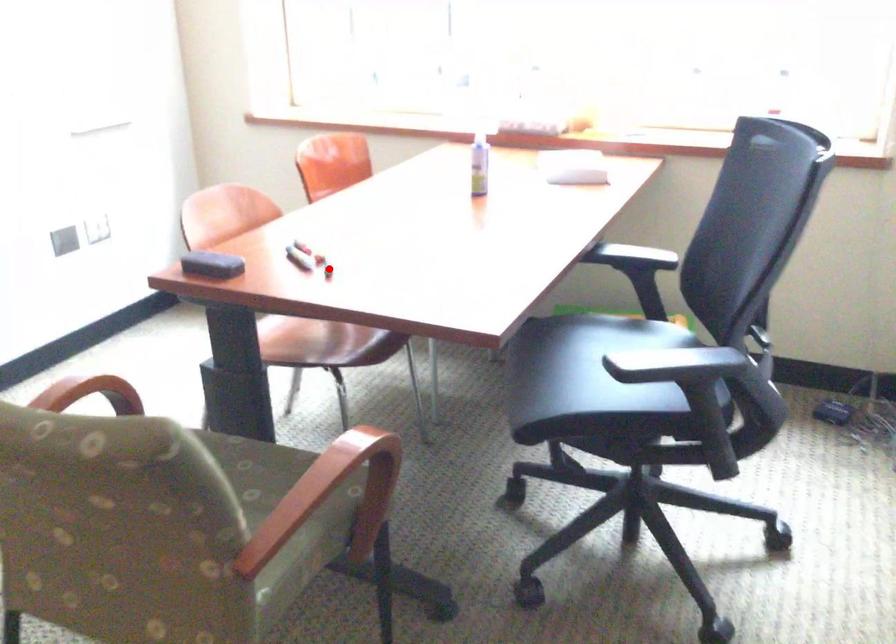
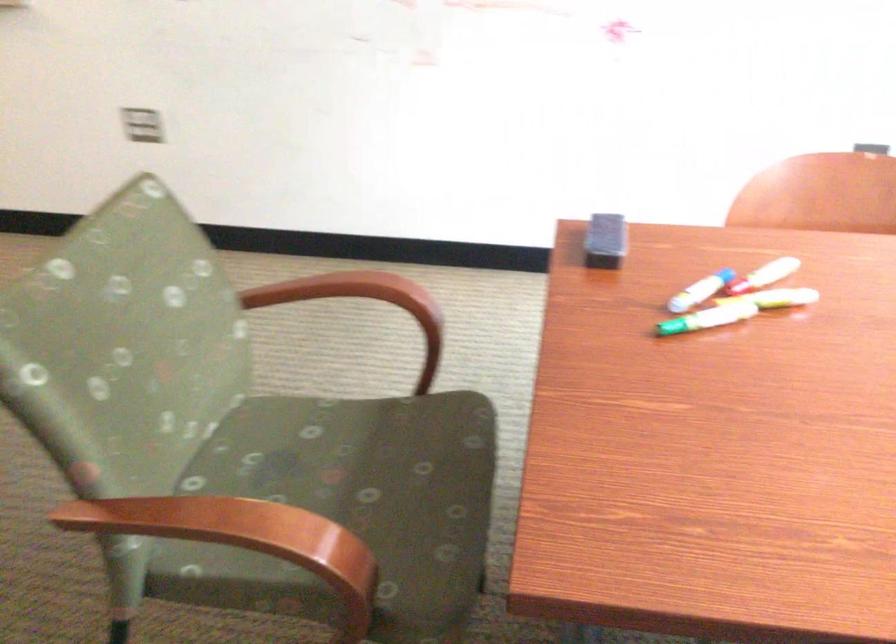
Locate, in the second image, the point that corresponds to the highlighted location in the first image.

(675, 327)